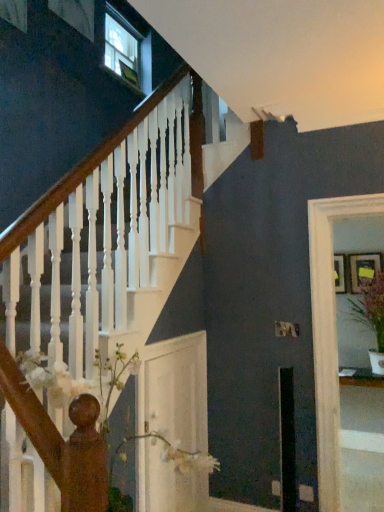
Question: Considering the positions of point (337, 272) and point (360, 265), is point (337, 272) closer or farther from the camera than point (360, 265)?

Choices:
 (A) closer
 (B) farther

Answer: (B)

Question: In terms of width, does wooden picture frame at right, the second picture frame in the right-to-left sequence, look wider or thinner when compared to wooden picture frame at upper right, the 1th picture frame from the right?

Choices:
 (A) thin
 (B) wide

Answer: (A)

Question: Which object is the closest to the green leafy plant in white pot at right?

Choices:
 (A) clear glass door at right, the 2th glass door viewed from the left
 (B) wooden picture frame at upper right, the 2th picture frame from the left
 (C) wooden picture frame at right, which appears as the first picture frame when viewed from the left
 (D) white glossy door at center, the first glass door when ordered from left to right

Answer: (B)

Question: Which object is the farthest from the white glossy door at center, the 2th glass door in the right-to-left sequence?

Choices:
 (A) green leafy plant in white pot at right
 (B) wooden picture frame at right, which appears as the first picture frame when viewed from the left
 (C) clear glass door at right, the 1th glass door viewed from the right
 (D) wooden picture frame at upper right, the 1th picture frame from the right

Answer: (D)